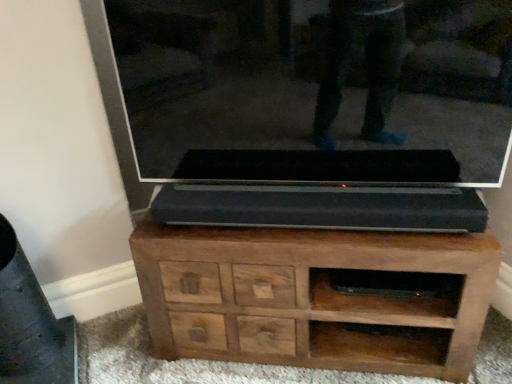
Question: In terms of width, does transparent glass tv at center look wider or thinner when compared to brown wood chest of drawers at center?

Choices:
 (A) wide
 (B) thin

Answer: (B)

Question: Is transparent glass tv at center to the left or to the right of brown wood chest of drawers at center in the image?

Choices:
 (A) right
 (B) left

Answer: (B)

Question: Is transparent glass tv at center in front of or behind brown wood chest of drawers at center in the image?

Choices:
 (A) behind
 (B) front

Answer: (B)

Question: Considering the relative positions of brown wood chest of drawers at center and transparent glass tv at center in the image provided, is brown wood chest of drawers at center to the left or to the right of transparent glass tv at center?

Choices:
 (A) left
 (B) right

Answer: (B)

Question: From a real-world perspective, is brown wood chest of drawers at center positioned above or below transparent glass tv at center?

Choices:
 (A) above
 (B) below

Answer: (B)

Question: Looking at the image, does brown wood chest of drawers at center seem bigger or smaller compared to transparent glass tv at center?

Choices:
 (A) small
 (B) big

Answer: (B)

Question: Considering the positions of brown wood chest of drawers at center and transparent glass tv at center in the image, is brown wood chest of drawers at center taller or shorter than transparent glass tv at center?

Choices:
 (A) tall
 (B) short

Answer: (B)